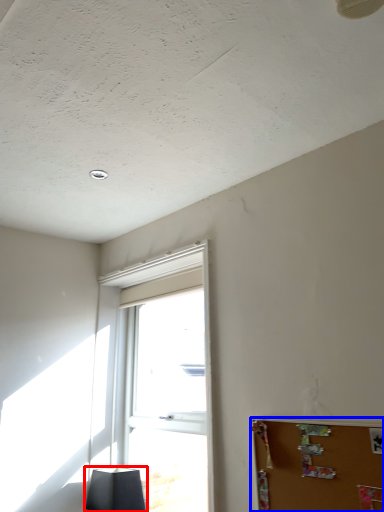
Question: Among these objects, which one is nearest to the camera, lamp (highlighted by a red box) or bulletin board (highlighted by a blue box)?

Choices:
 (A) lamp
 (B) bulletin board

Answer: (B)